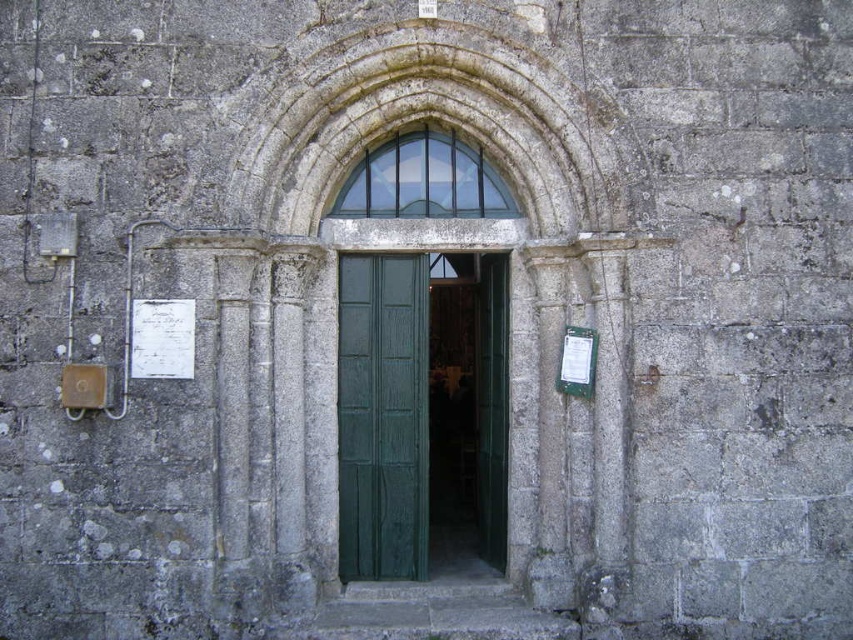
Is clear glass window at center taller than white paper at right?

Yes, clear glass window at center is taller than white paper at right.

Is point (439, 170) more distant than point (583, 394)?

Yes, point (439, 170) is behind point (583, 394).

In order to click on clear glass window at center in this screenshot , I will do `click(424, 180)`.

Which is above, green wooden door at center or white paper at right?

white paper at right

The image size is (853, 640). What are the coordinates of `green wooden door at center` in the screenshot? It's located at (381, 417).

Who is more distant from viewer, (375, 148) or (155, 339)?

Positioned behind is point (375, 148).

Does point (482, 160) come behind point (144, 339)?

Yes, point (482, 160) is farther from viewer.

This screenshot has width=853, height=640. I want to click on clear glass window at center, so click(x=424, y=180).